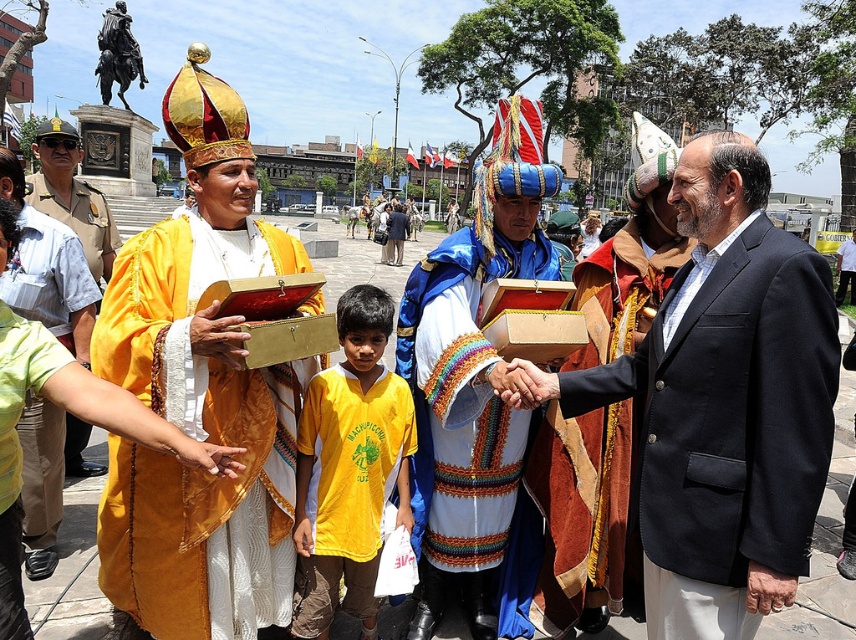
Does yellow jersey at center have a greater height compared to yellow velvet robe at center?

Incorrect, yellow jersey at center's height is not larger of yellow velvet robe at center's.

Where is `yellow jersey at center`? The width and height of the screenshot is (856, 640). yellow jersey at center is located at coordinates (349, 468).

Is dark blue suit at center taller than yellow velvet robe at center?

No, dark blue suit at center is not taller than yellow velvet robe at center.

Describe the element at coordinates (724, 403) in the screenshot. The width and height of the screenshot is (856, 640). I see `dark blue suit at center` at that location.

The height and width of the screenshot is (640, 856). I want to click on dark blue suit at center, so click(724, 403).

Between point (144, 596) and point (366, 323), which one is positioned behind?

Point (366, 323)

Which of these two, matte gold vestment at left or yellow jersey at center, stands taller?

With more height is yellow jersey at center.

Is point (177, 416) in front of point (354, 600)?

Yes, it is.

The width and height of the screenshot is (856, 640). Find the location of `matte gold vestment at left`. matte gold vestment at left is located at coordinates (197, 438).